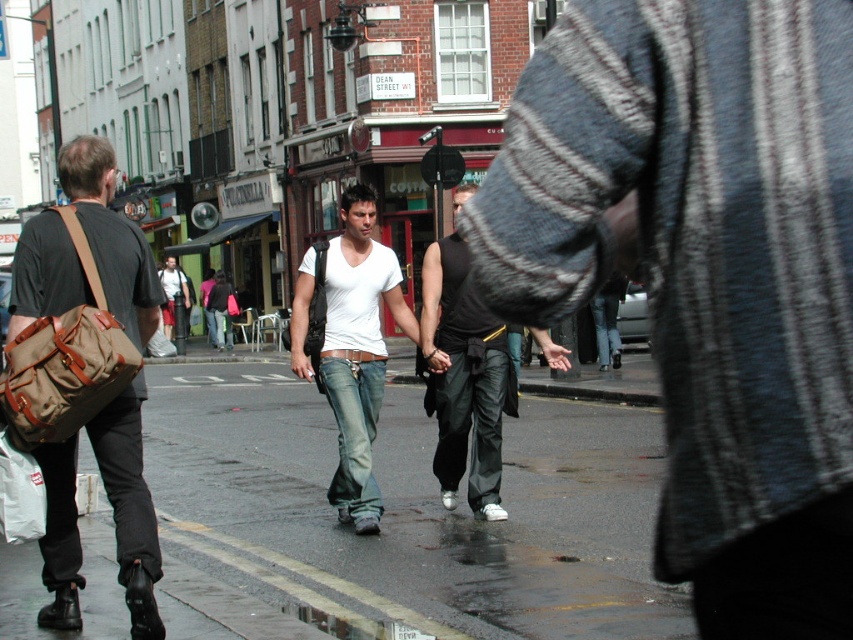
Based on the photo, is wet asphalt at lower center thinner than matte brown bag at left?

No, wet asphalt at lower center is not thinner than matte brown bag at left.

Is point (289, 420) in front of point (114, 266)?

No.

Where is `wet asphalt at lower center`? The height and width of the screenshot is (640, 853). wet asphalt at lower center is located at coordinates (421, 506).

You are a GUI agent. You are given a task and a screenshot of the screen. Output one action in this format:
    pyautogui.click(x=<x>, y=<y>)
    Task: Click on the matte brown bag at left
    This screenshot has width=853, height=640.
    Given the screenshot: What is the action you would take?
    pyautogui.click(x=131, y=508)

Is matte brown bag at left to the right of light brown leather jacket at center from the viewer's perspective?

Indeed, matte brown bag at left is positioned on the right side of light brown leather jacket at center.

Where is `matte brown bag at left`? The width and height of the screenshot is (853, 640). matte brown bag at left is located at coordinates (131, 508).

Locate an element on the screen. This screenshot has height=640, width=853. matte brown bag at left is located at coordinates (131, 508).

Which of these two, white matte t-shirt at center or black leather pants at center, stands taller?

Standing taller between the two is black leather pants at center.

Which is more to the right, white matte t-shirt at center or black leather pants at center?

From the viewer's perspective, white matte t-shirt at center appears more on the right side.

Which is in front, point (550, 209) or point (440, 241)?

Point (550, 209)

Identify the location of white matte t-shirt at center. (705, 273).